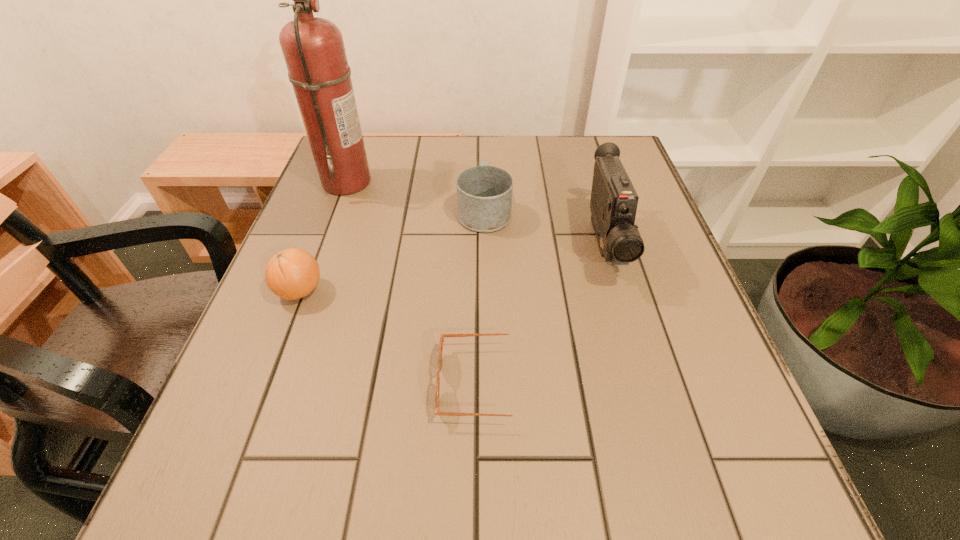
This screenshot has height=540, width=960. I want to click on fire extinguisher, so click(313, 48).

Find the location of a particular element. This screenshot has width=960, height=540. the rightmost object is located at coordinates (613, 205).

I want to click on camcorder, so click(613, 205).

This screenshot has height=540, width=960. Find the location of `mug`. mug is located at coordinates (484, 193).

Identify the location of orange. (293, 273).

This screenshot has width=960, height=540. Find the location of `the shortest object`. the shortest object is located at coordinates [x=437, y=393].

Identify the location of the nearest object. (437, 393).

Locate an element on the screen. The height and width of the screenshot is (540, 960). vacant space positioned 0.180m on the front-facing side of the fire extinguisher is located at coordinates (443, 181).

Locate an element on the screen. Image resolution: width=960 pixels, height=540 pixels. free space located on the front-facing side of the camcorder is located at coordinates (641, 374).

Find the location of a particular element. Image resolution: width=960 pixels, height=540 pixels. vacant area located 0.230m on the side of the mug with the handle is located at coordinates (484, 144).